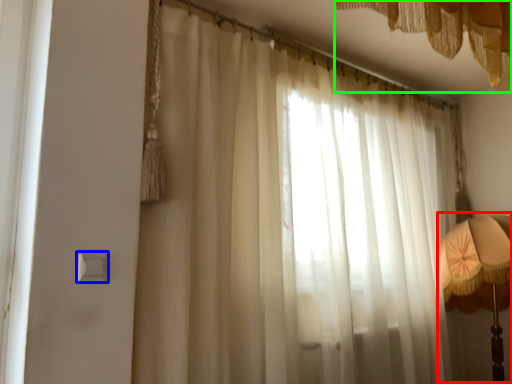
Question: Which object is the closest to the bedside lamp (highlighted by a red box)? Choose among these: light switch (highlighted by a blue box) or curtain (highlighted by a green box).

Choices:
 (A) light switch
 (B) curtain

Answer: (B)